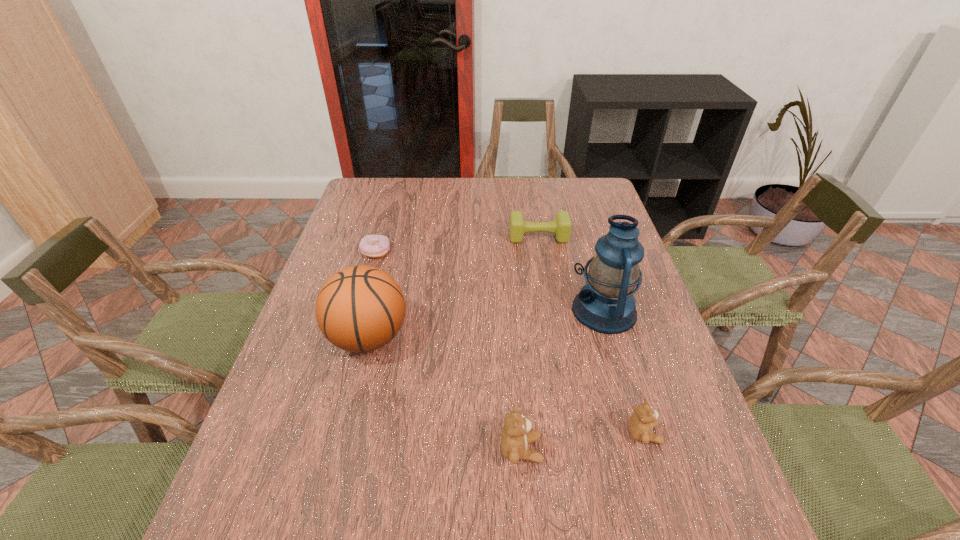
Find the location of a particular element. This screenshot has height=540, width=960. free space located 0.230m on the back of the dumbbell is located at coordinates (531, 194).

Locate an element on the screen. The image size is (960, 540). free region located 0.380m on the back of the doughnut is located at coordinates (396, 184).

Find the location of a particular element. The height and width of the screenshot is (540, 960). free space located on the face of the tallest object is located at coordinates (429, 310).

This screenshot has width=960, height=540. I want to click on vacant space located on the face of the tallest object, so click(x=437, y=310).

Locate an element on the screen. free point located 0.270m on the face of the tallest object is located at coordinates (470, 310).

Identify the location of free region located 0.140m on the right of the fifth shortest object. Image resolution: width=960 pixels, height=540 pixels. (466, 336).

You are a GUI agent. You are given a task and a screenshot of the screen. Output one action in this format:
    pyautogui.click(x=<x>, y=<y>)
    Task: Click on the doughnut positioned at the left edge
    The image size is (960, 540).
    Given the screenshot: What is the action you would take?
    pyautogui.click(x=374, y=246)

This screenshot has width=960, height=540. I want to click on basketball located in the left edge section of the desktop, so pyautogui.click(x=359, y=309).

What are the coordinates of `teddy bear located in the right edge section of the desktop` in the screenshot? It's located at (643, 420).

The height and width of the screenshot is (540, 960). I want to click on lantern that is at the right edge, so click(x=606, y=304).